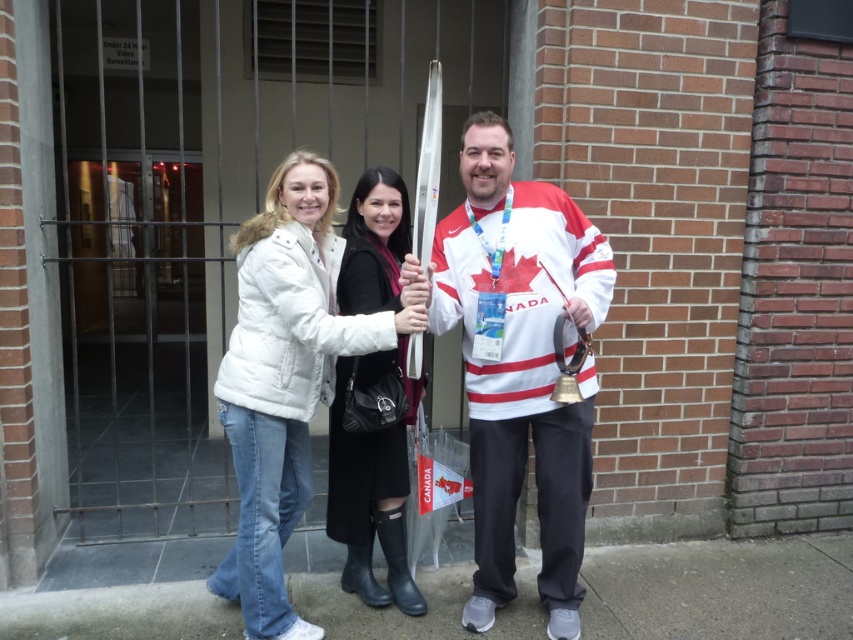
You are a photographer trying to capture a group photo of the three individuals standing in front of the metal security gate. You need to ensure that both the white jersey at center and the white fleece jacket at center are clearly visible in the frame. Given their sizes, which clothing item should you focus on to ensure both are in focus?

The white jersey at center has a larger size compared to the white fleece jacket at center. To ensure both are in focus, you should focus on the white jersey at center since its larger size will be easier to capture clearly, allowing the smaller white fleece jacket at center to also remain in focus within the same plane.

You are a photographer trying to capture a group photo of the three people in front of the security gate. You want to ensure that the white fleece jacket at center and the black leather boots at center are both clearly visible in the photo. Based on their heights, which object should you focus on to ensure both are in focus?

The white fleece jacket at center is much taller than the black leather boots at center. To ensure both are in focus, focus on the white fleece jacket at center since it is taller and will require the camera to adjust for the greater distance.

In the scene shown: You are a security guard checking the attire of two people standing at the center. According to the scene, which object is positioned higher on their body, the white fleece jacket at center or the black leather boots at center?

The white fleece jacket at center is positioned higher on their body than the black leather boots at center.